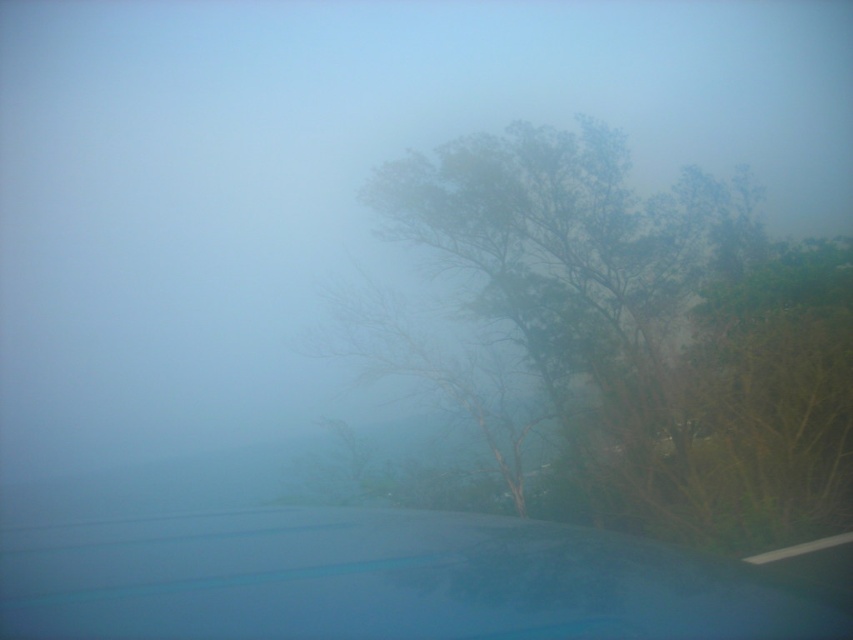
Does green matte tree at center appear on the left side of glossy blue car window at lower center?

In fact, green matte tree at center is to the right of glossy blue car window at lower center.

This screenshot has width=853, height=640. Identify the location of green matte tree at center. (650, 326).